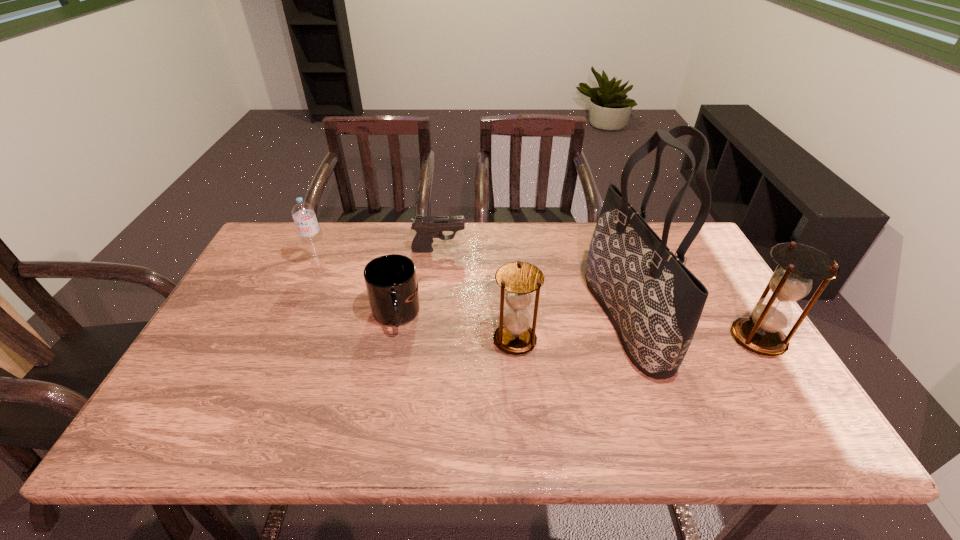
Find the location of a particular element. The width and height of the screenshot is (960, 540). the left hourglass is located at coordinates (518, 280).

Image resolution: width=960 pixels, height=540 pixels. I want to click on the shorter hourglass, so click(518, 280).

The height and width of the screenshot is (540, 960). I want to click on the rightmost object, so click(798, 264).

This screenshot has height=540, width=960. In order to click on the right hourglass in this screenshot , I will do `click(798, 264)`.

Locate an element on the screen. the leftmost object is located at coordinates (303, 214).

Identify the location of mug. (391, 282).

The width and height of the screenshot is (960, 540). I want to click on the farthest object, so coord(427,227).

Locate an element on the screen. This screenshot has width=960, height=540. tote bag is located at coordinates (655, 303).

Locate an element on the screen. the tallest object is located at coordinates (655, 303).

At what (x,y) coordinates should I click in order to perform the action: click on free space located 0.130m on the back of the shorter hourglass. Please return your answer as a coordinate pair (x, y). Looking at the image, I should click on (511, 291).